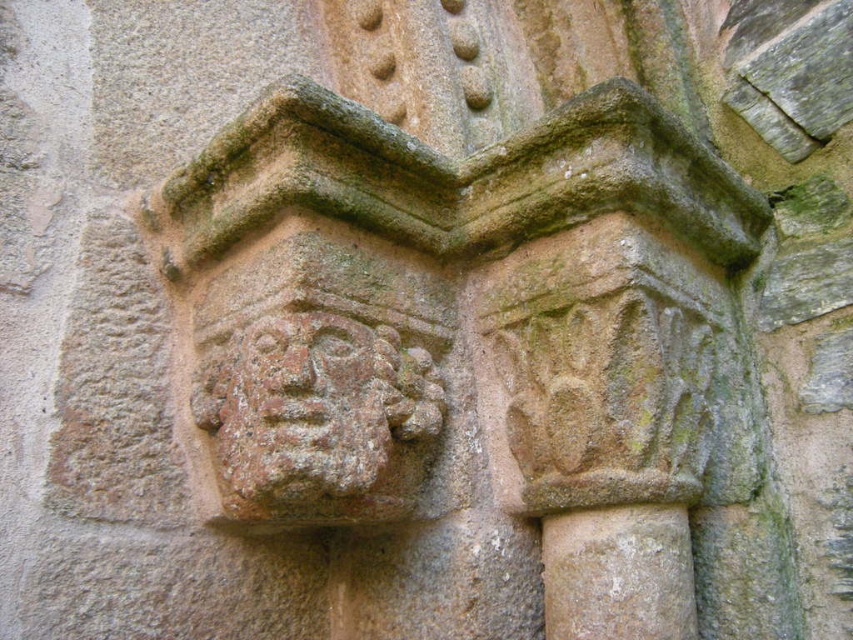
You are an architect examining the stone carvings in the image. You need to determine which of the two carvings, the brown stone carving at center or the rustic stone face at center, requires more material to create. Based on their sizes, which one would you choose?

The brown stone carving at center is bigger than the rustic stone face at center, so it would require more material to create.

You are an art conservator examining the stone carvings. You notice that the brown stone carving at center and the rustic stone face at center are positioned in a way that might affect their preservation. Which carving is more exposed to environmental elements like rain or wind?

The brown stone carving at center is in front of the rustic stone face at center, so it is more exposed to environmental elements like rain or wind.

You are an art conservator examining the stone carvings. You need to document the relative positions of the brown stone carving at center and the rustic stone face at center. Which carving is located to the right of the other?

The brown stone carving at center is positioned on the right side of rustic stone face at center.